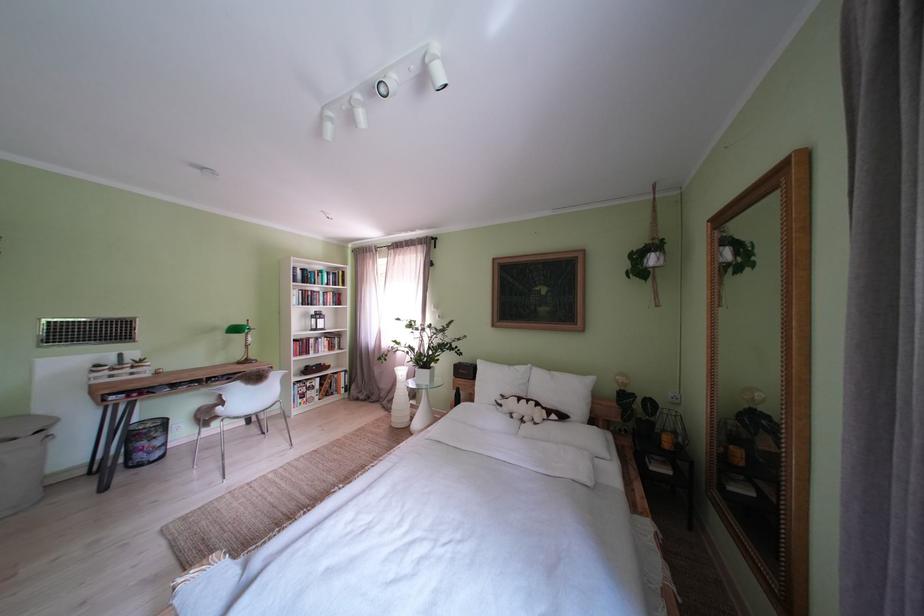
What do you see at coordinates (465, 370) in the screenshot? The height and width of the screenshot is (616, 924). I see `the black portable speaker` at bounding box center [465, 370].